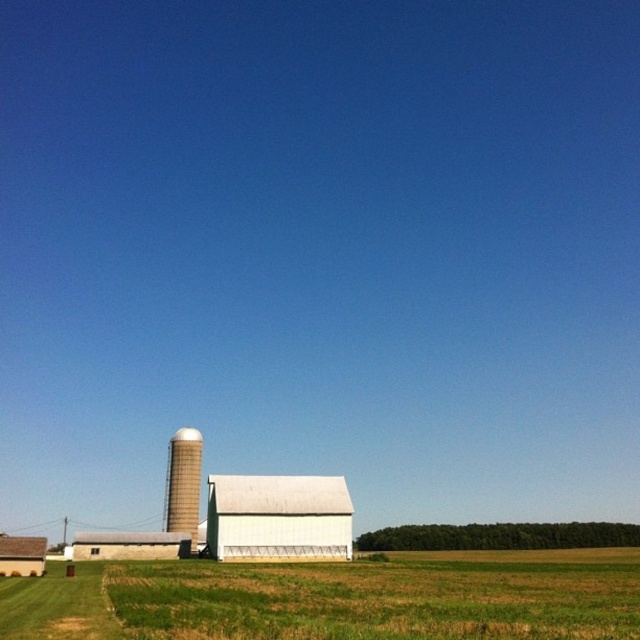
Looking at this image, you are a farmer standing at the edge of your field and see the white matte barn at center and the white matte barn at lower left. Which barn is closer to you?

The white matte barn at lower left is closer to you since it is only 103.08 feet away from the white matte barn at center, but the question does not provide the distance from you to either barn. Without knowing your position relative to both barns, it is impossible to determine which is closer.

You are standing in the field looking towards the white matte barn at center and the white matte barn at lower left. Which barn appears closer to you?

The white matte barn at center appears closer because it is further to the viewer than the white matte barn at lower left.